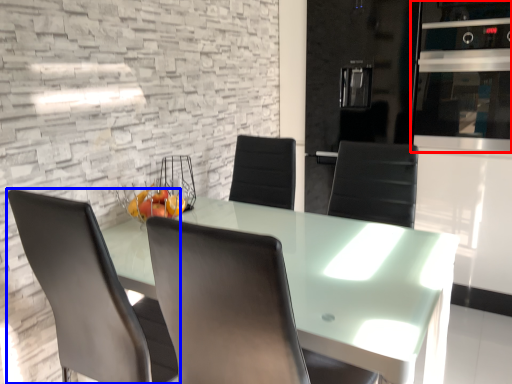
Question: Which object appears closest to the camera in this image, appliance (highlighted by a red box) or chair (highlighted by a blue box)?

Choices:
 (A) appliance
 (B) chair

Answer: (B)